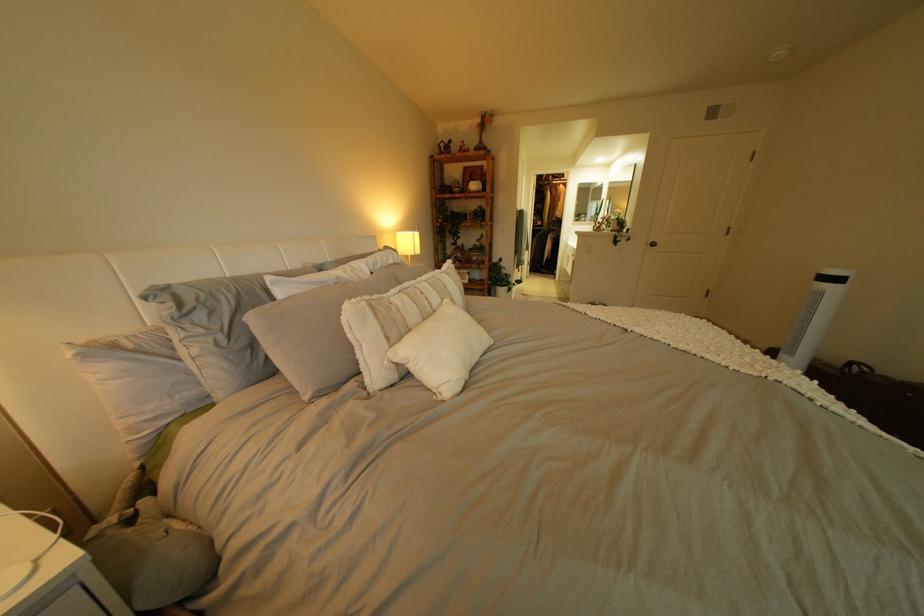
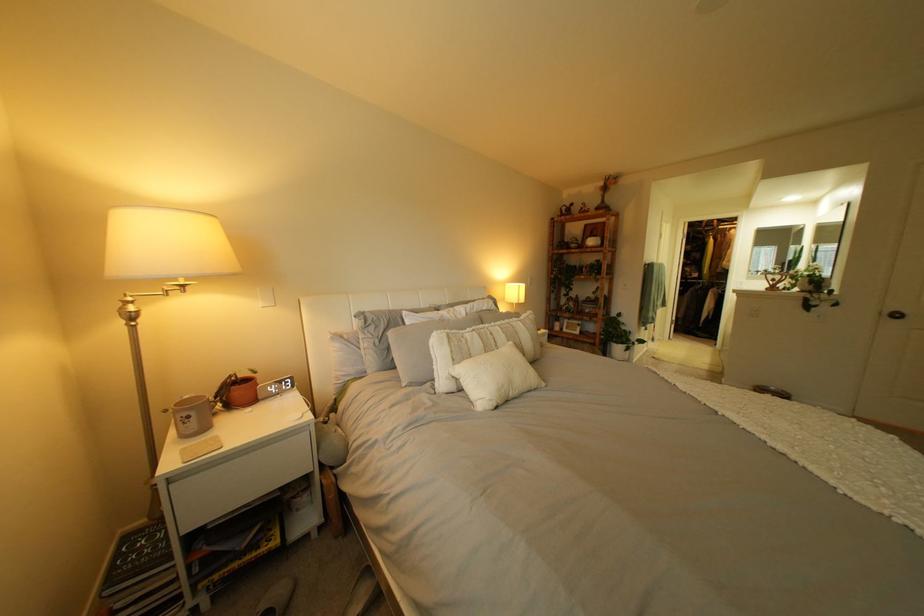
The point at (665, 244) is marked in the first image. Where is the corresponding point in the second image?

(903, 313)